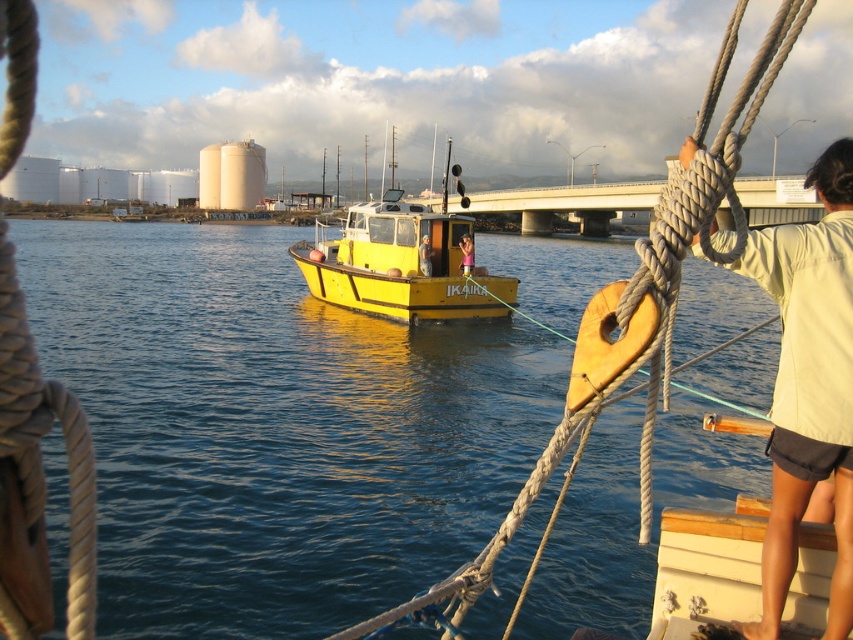
Question: Can you confirm if light beige fabric shirt at right is positioned to the left of yellow matte boat at center?

Choices:
 (A) yes
 (B) no

Answer: (B)

Question: Is light beige fabric shirt at right closer to the viewer compared to yellow matte boat at center?

Choices:
 (A) yes
 (B) no

Answer: (A)

Question: From the image, what is the correct spatial relationship of light beige fabric shirt at right in relation to pink fabric at center?

Choices:
 (A) below
 (B) above

Answer: (A)

Question: Among these objects, which one is farthest from the camera?

Choices:
 (A) light brown wooden door at center
 (B) pink fabric at center
 (C) yellow matte boat at center

Answer: (A)

Question: Which is nearer to the shiny blue water at center?

Choices:
 (A) light beige fabric shirt at right
 (B) pink fabric at center

Answer: (B)

Question: Among these points, which one is farthest from the camera?

Choices:
 (A) (596, 472)
 (B) (422, 236)
 (C) (773, 241)

Answer: (B)